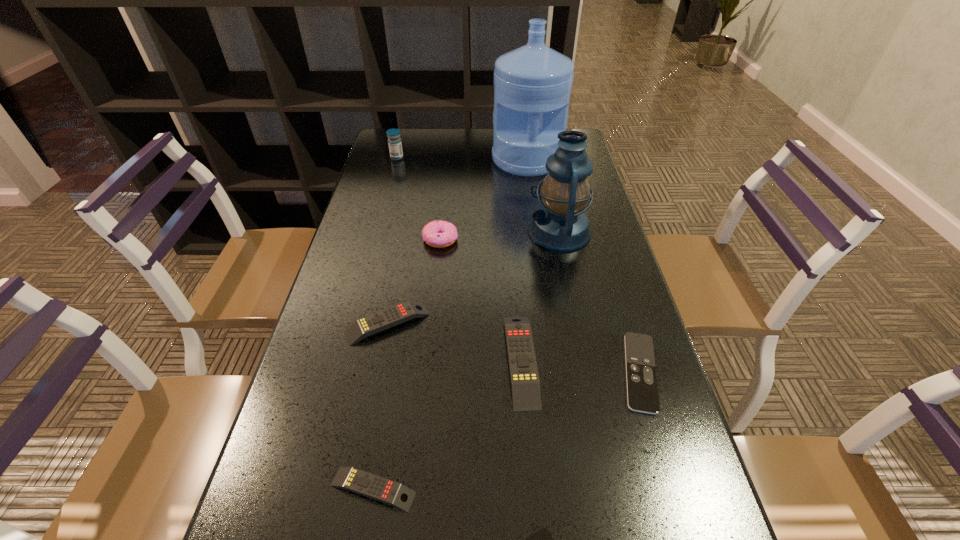
Where is `blue water jug`? This screenshot has height=540, width=960. blue water jug is located at coordinates (532, 84).

The width and height of the screenshot is (960, 540). I want to click on the tallest object, so click(x=532, y=84).

At what (x,y) coordinates should I click in order to perform the action: click on the eighth shortest object. Please return your answer as a coordinate pair (x, y). Image resolution: width=960 pixels, height=540 pixels. Looking at the image, I should click on (560, 225).

Where is `blue lantern`? blue lantern is located at coordinates (560, 225).

Where is `the seventh shortest object`? This screenshot has width=960, height=540. the seventh shortest object is located at coordinates (394, 141).

At what (x,y) coordinates should I click in order to perform the action: click on blue medicine. Please return your answer as a coordinate pair (x, y). This screenshot has height=540, width=960. Looking at the image, I should click on (394, 141).

Image resolution: width=960 pixels, height=540 pixels. Identify the location of doughnut. (439, 234).

You are a GUI agent. You are given a task and a screenshot of the screen. Output one action in this format:
    pyautogui.click(x=<x>, y=<y>)
    Task: Click on the pink doughnut
    Image resolution: width=960 pixels, height=540 pixels.
    Given the screenshot: What is the action you would take?
    pyautogui.click(x=439, y=234)

Identify the location of the fifth shortest object. (525, 385).

Image resolution: width=960 pixels, height=540 pixels. Identify the location of the tallest remote control. (525, 385).